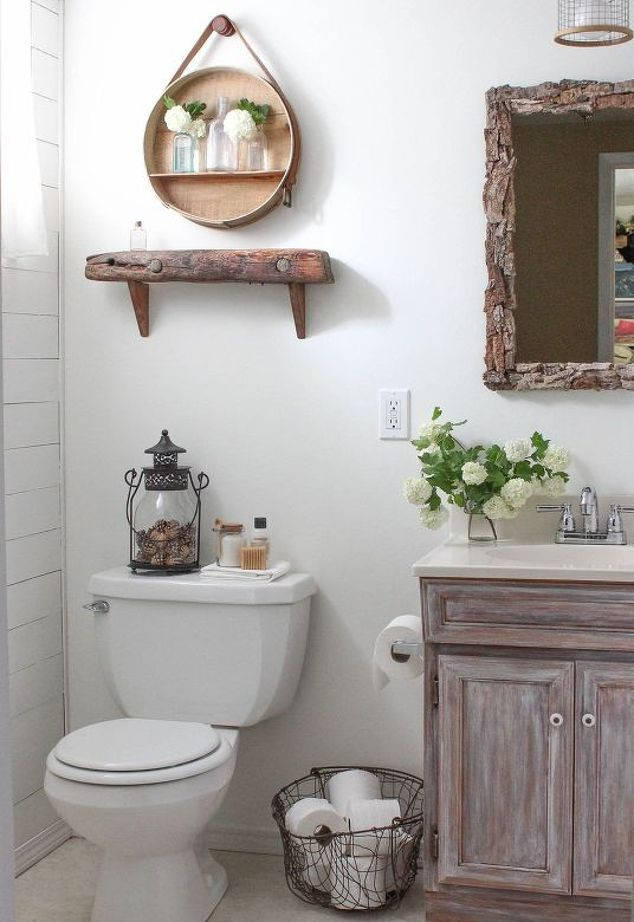
This screenshot has height=922, width=634. What are the coordinates of `trim in corner` in the screenshot? It's located at (65, 682), (61, 258).